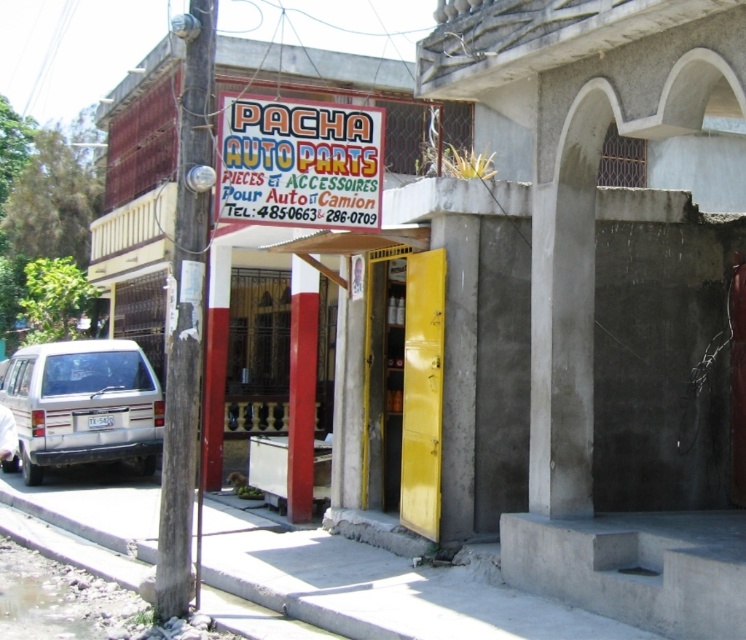
You are a customer looking for the entrance to Pacha Auto Parts. You see the bright yellow signboard at upper center and the white matte suv at lower left. Which object is wider?

The bright yellow signboard at upper center has a lesser width compared to the white matte suv at lower left, so the white matte suv at lower left is wider.

You are a customer entering the Pacha Auto Parts store. You need to locate the bright yellow signboard at upper center and the white matte suv at lower left. Which object is smaller in size?

The bright yellow signboard at upper center is smaller than the white matte suv at lower left.